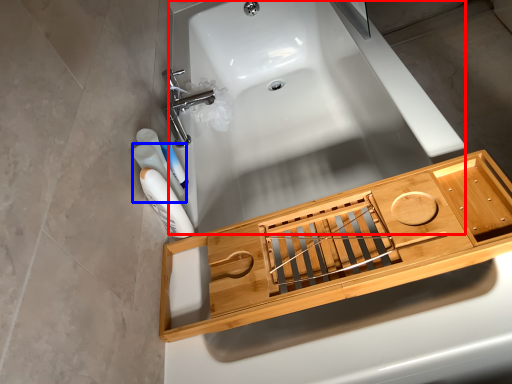
Question: Which object appears farthest to the camera in this image, bath (highlighted by a red box) or mouthwash (highlighted by a blue box)?

Choices:
 (A) bath
 (B) mouthwash

Answer: (B)